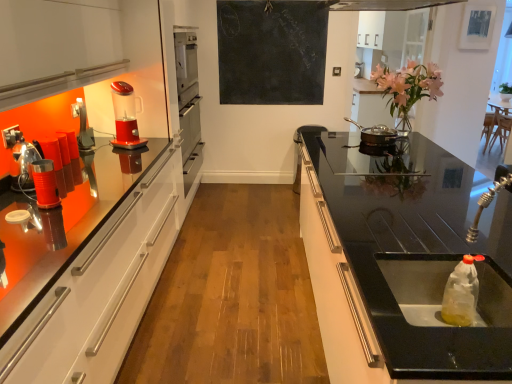
Locate an element on the screen. The height and width of the screenshot is (384, 512). translucent plastic sink at lower right is located at coordinates (417, 276).

How much space does metallic stainless steel cup at left, marked as the 1th appliance in a left-to-right arrangement, occupy horizontally?

The width of metallic stainless steel cup at left, marked as the 1th appliance in a left-to-right arrangement, is 7.12 inches.

Describe the element at coordinates (401, 260) in the screenshot. I see `black glass sink at right` at that location.

This screenshot has height=384, width=512. I want to click on black glass sink at right, so click(401, 260).

What do you see at coordinates (376, 134) in the screenshot? I see `shiny silver pan at center, placed as the 3th appliance when sorted from front to back` at bounding box center [376, 134].

You are a GUI agent. You are given a task and a screenshot of the screen. Output one action in this format:
    pyautogui.click(x=<x>, y=<y>)
    Task: Click on the metallic red canister at left, marked as the 2th appliance in a left-to-right arrangement
    This screenshot has width=512, height=384.
    Given the screenshot: What is the action you would take?
    pyautogui.click(x=45, y=184)

Locate an element on the screen. This screenshot has width=512, height=384. translucent plastic sink at lower right is located at coordinates (417, 276).

Is metallic stainless steel cup at left, marked as the 1th appliance in a left-to-right arrangement, shorter than shiny silver pan at center, the 1th appliance viewed from the back?

No, metallic stainless steel cup at left, marked as the 1th appliance in a left-to-right arrangement, is not shorter than shiny silver pan at center, the 1th appliance viewed from the back.

From the image's perspective, is metallic stainless steel cup at left, the third appliance positioned from the right, above or below shiny silver pan at center, the first appliance when ordered from right to left?

Clearly, from the image's perspective, metallic stainless steel cup at left, the third appliance positioned from the right, is below shiny silver pan at center, the first appliance when ordered from right to left.

Considering the relative sizes of metallic stainless steel cup at left, the 2th appliance positioned from the front, and shiny silver pan at center, the 1th appliance viewed from the back, in the image provided, is metallic stainless steel cup at left, the 2th appliance positioned from the front, smaller than shiny silver pan at center, the 1th appliance viewed from the back,?

Yes, metallic stainless steel cup at left, the 2th appliance positioned from the front, is smaller than shiny silver pan at center, the 1th appliance viewed from the back.

What's the angular difference between metallic stainless steel cup at left, which is the 2th appliance in back-to-front order, and shiny silver pan at center, which ranks as the 3th appliance in left-to-right order,'s facing directions?

The facing directions of metallic stainless steel cup at left, which is the 2th appliance in back-to-front order, and shiny silver pan at center, which ranks as the 3th appliance in left-to-right order, are 52.7 degrees apart.

Considering the relative sizes of black chalkboard at upper center and black glass sink at right in the image provided, is black chalkboard at upper center shorter than black glass sink at right?

Incorrect, the height of black chalkboard at upper center does not fall short of that of black glass sink at right.

In order to click on bulletin board on the left of black glass sink at right in this screenshot , I will do `click(272, 52)`.

From the image's perspective, is black chalkboard at upper center located above black glass sink at right?

Correct, black chalkboard at upper center appears higher than black glass sink at right in the image.

From a real-world perspective, is black chalkboard at upper center physically below shiny silver pan at center, the first appliance when ordered from right to left?

Incorrect, from a real-world perspective, black chalkboard at upper center is higher than shiny silver pan at center, the first appliance when ordered from right to left.

Which is more to the left, black chalkboard at upper center or shiny silver pan at center, which ranks as the 3th appliance in left-to-right order?

Positioned to the left is black chalkboard at upper center.

How many degrees apart are the facing directions of black chalkboard at upper center and shiny silver pan at center, placed as the 3th appliance when sorted from front to back?

The facing directions of black chalkboard at upper center and shiny silver pan at center, placed as the 3th appliance when sorted from front to back, are 39.1 degrees apart.

Based on the photo, is black chalkboard at upper center oriented towards shiny silver pan at center, the 1th appliance viewed from the back?

Yes, black chalkboard at upper center is facing shiny silver pan at center, the 1th appliance viewed from the back.

Find the location of a particular element. the 2nd appliance counting from the left of the translucent plastic sink at lower right is located at coordinates (22, 162).

From the image's perspective, is translucent plastic sink at lower right above or below metallic stainless steel cup at left, which is the 2th appliance in back-to-front order?

translucent plastic sink at lower right is below metallic stainless steel cup at left, which is the 2th appliance in back-to-front order.

Considering their positions, is translucent plastic sink at lower right located in front of or behind metallic stainless steel cup at left, the third appliance positioned from the right?

In the image, translucent plastic sink at lower right appears in front of metallic stainless steel cup at left, the third appliance positioned from the right.

In the scene shown: Can you confirm if translucent plastic sink at lower right is positioned to the left of metallic stainless steel cup at left, which is the 2th appliance in back-to-front order?

Incorrect, translucent plastic sink at lower right is not on the left side of metallic stainless steel cup at left, which is the 2th appliance in back-to-front order.

Is black glass sink at right beside metallic red canister at left, placed as the first appliance when sorted from front to back?

Result: No, black glass sink at right is not beside metallic red canister at left, placed as the first appliance when sorted from front to back.

Does black glass sink at right lie behind metallic red canister at left, placed as the first appliance when sorted from front to back?

No, the depth of black glass sink at right is less than that of metallic red canister at left, placed as the first appliance when sorted from front to back.

Who is bigger, black glass sink at right or metallic red canister at left, which is the 2th appliance in right-to-left order?

black glass sink at right.

In the image, is translucent plastic blender at left positioned in front of or behind black glass sink at right?

translucent plastic blender at left is positioned farther from the viewer than black glass sink at right.

How many degrees apart are the facing directions of translucent plastic blender at left and black glass sink at right?

They differ by 154 degrees in their facing directions.

Considering the relative sizes of translucent plastic blender at left and black glass sink at right in the image provided, is translucent plastic blender at left shorter than black glass sink at right?

Yes, translucent plastic blender at left is shorter than black glass sink at right.

From a real-world perspective, is translucent plastic blender at left over black glass sink at right?

Indeed, from a real-world perspective, translucent plastic blender at left stands above black glass sink at right.

Is point (497, 270) closer or farther from the camera than point (372, 126)?

Point (497, 270) is closer to the camera than point (372, 126).

From a real-world perspective, which is physically above, translucent plastic sink at lower right or shiny silver pan at center, the first appliance when ordered from right to left?

shiny silver pan at center, the first appliance when ordered from right to left, is physically above.

Between translucent plastic sink at lower right and shiny silver pan at center, the 1th appliance viewed from the back, which one has smaller size?

With smaller size is shiny silver pan at center, the 1th appliance viewed from the back.

Can shiny silver pan at center, the first appliance when ordered from right to left, be found inside translucent plastic sink at lower right?

Actually, shiny silver pan at center, the first appliance when ordered from right to left, is outside translucent plastic sink at lower right.

Locate an element on the screen. appliance behind the metallic stainless steel cup at left, the third appliance positioned from the right is located at coordinates pyautogui.click(x=376, y=134).

This screenshot has width=512, height=384. Find the location of `bulletin board above the black glass sink at right (from the image's perspective)`. bulletin board above the black glass sink at right (from the image's perspective) is located at coordinates (272, 52).

Considering their positions, is translucent plastic sink at lower right positioned closer to shiny silver pan at center, which ranks as the 3th appliance in left-to-right order, than black chalkboard at upper center?

translucent plastic sink at lower right.

From the image, which object appears to be nearer to shiny silver pan at center, the 1th appliance viewed from the back, translucent plastic blender at left or black chalkboard at upper center?

translucent plastic blender at left is positioned closer to the anchor shiny silver pan at center, the 1th appliance viewed from the back.

In the scene shown: Looking at the image, which one is located further to metallic stainless steel cup at left, the 2th appliance positioned from the front, shiny silver pan at center, the 1th appliance viewed from the back, or black glass sink at right?

shiny silver pan at center, the 1th appliance viewed from the back, is further to metallic stainless steel cup at left, the 2th appliance positioned from the front.

Estimate the real-world distances between objects in this image. Which object is further from black glass sink at right, metallic red canister at left, which is the 2th appliance in right-to-left order, or translucent plastic blender at left?

translucent plastic blender at left is further to black glass sink at right.

From the image, which object appears to be farther from metallic stainless steel cup at left, which is the 2th appliance in back-to-front order, translucent plastic blender at left or black glass sink at right?

Among the two, black glass sink at right is located further to metallic stainless steel cup at left, which is the 2th appliance in back-to-front order.

When comparing their distances from metallic stainless steel cup at left, the third appliance positioned from the right, does black chalkboard at upper center or translucent plastic sink at lower right seem closer?

The object closer to metallic stainless steel cup at left, the third appliance positioned from the right, is translucent plastic sink at lower right.

Looking at the image, which one is located further to metallic stainless steel cup at left, marked as the 1th appliance in a left-to-right arrangement, translucent plastic blender at left or metallic red canister at left, placed as the first appliance when sorted from front to back?

Based on the image, translucent plastic blender at left appears to be further to metallic stainless steel cup at left, marked as the 1th appliance in a left-to-right arrangement.

From the image, which object appears to be farther from metallic red canister at left, marked as the 2th appliance in a left-to-right arrangement, black chalkboard at upper center or translucent plastic blender at left?

black chalkboard at upper center lies further to metallic red canister at left, marked as the 2th appliance in a left-to-right arrangement, than the other object.

This screenshot has width=512, height=384. In order to click on sink situated between metallic stainless steel cup at left, the 2th appliance positioned from the front, and black glass sink at right from left to right in this screenshot , I will do `click(417, 276)`.

Identify the location of sink between metallic stainless steel cup at left, marked as the 1th appliance in a left-to-right arrangement, and shiny silver pan at center, the first appliance when ordered from right to left, from left to right. (417, 276).

Locate an element on the screen. The image size is (512, 384). kitchen appliance located between metallic stainless steel cup at left, the 2th appliance positioned from the front, and black chalkboard at upper center in the depth direction is located at coordinates (125, 117).

This screenshot has width=512, height=384. I want to click on kitchen appliance between black glass sink at right and black chalkboard at upper center along the z-axis, so click(x=125, y=117).